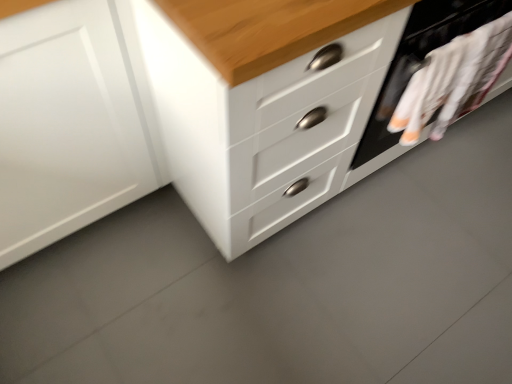
Question: Is white fabric at right positioned beyond the bounds of white glossy chest of drawers at center?

Choices:
 (A) yes
 (B) no

Answer: (A)

Question: Considering the relative sizes of white fabric at right and white glossy chest of drawers at center in the image provided, is white fabric at right smaller than white glossy chest of drawers at center?

Choices:
 (A) no
 (B) yes

Answer: (B)

Question: Is white fabric at right to the right of white glossy chest of drawers at center from the viewer's perspective?

Choices:
 (A) yes
 (B) no

Answer: (A)

Question: From the image's perspective, is white fabric at right on white glossy chest of drawers at center?

Choices:
 (A) yes
 (B) no

Answer: (B)

Question: Is white glossy chest of drawers at center completely or partially inside white fabric at right?

Choices:
 (A) yes
 (B) no

Answer: (B)

Question: Looking at their shapes, would you say white matte cabinet at left is wider or thinner than white glossy chest of drawers at center?

Choices:
 (A) wide
 (B) thin

Answer: (B)

Question: Considering the positions of point (93, 109) and point (311, 107), is point (93, 109) closer or farther from the camera than point (311, 107)?

Choices:
 (A) farther
 (B) closer

Answer: (A)

Question: In terms of height, does white matte cabinet at left look taller or shorter compared to white glossy chest of drawers at center?

Choices:
 (A) short
 (B) tall

Answer: (A)

Question: From the image's perspective, is white matte cabinet at left located above or below white glossy chest of drawers at center?

Choices:
 (A) below
 (B) above

Answer: (A)

Question: Considering the positions of white fabric at right and white glossy chest of drawers at center in the image, is white fabric at right bigger or smaller than white glossy chest of drawers at center?

Choices:
 (A) small
 (B) big

Answer: (A)

Question: Visually, is white fabric at right positioned to the left or to the right of white glossy chest of drawers at center?

Choices:
 (A) right
 (B) left

Answer: (A)

Question: In terms of height, does white fabric at right look taller or shorter compared to white glossy chest of drawers at center?

Choices:
 (A) tall
 (B) short

Answer: (B)

Question: Is white fabric at right spatially inside white glossy chest of drawers at center, or outside of it?

Choices:
 (A) outside
 (B) inside

Answer: (A)

Question: Looking at the image, does white matte cabinet at left seem bigger or smaller compared to white fabric at right?

Choices:
 (A) small
 (B) big

Answer: (B)

Question: Would you say white matte cabinet at left is inside or outside white fabric at right?

Choices:
 (A) inside
 (B) outside

Answer: (B)